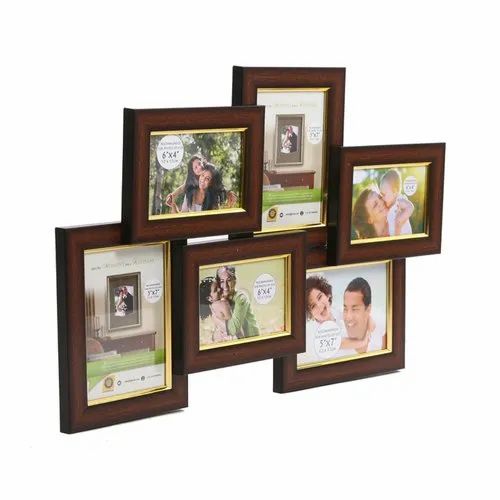
Image resolution: width=500 pixels, height=500 pixels. In order to click on picture frame in this screenshot , I will do `click(224, 130)`, `click(300, 93)`, `click(412, 160)`, `click(392, 272)`, `click(271, 260)`, `click(172, 282)`.